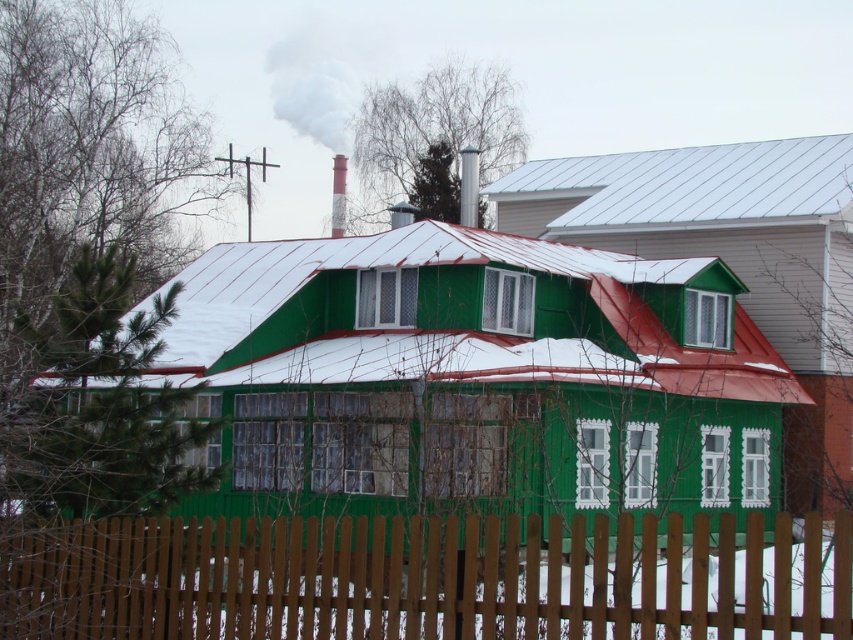
Is green painted wood at center further to camera compared to smooth metallic chimney at upper center?

No, it is in front of smooth metallic chimney at upper center.

This screenshot has height=640, width=853. I want to click on green painted wood at center, so click(x=457, y=264).

The width and height of the screenshot is (853, 640). Identify the location of green painted wood at center. (457, 264).

Between point (271, 268) and point (289, 33), which one is positioned behind?

The point (289, 33) is behind.

The height and width of the screenshot is (640, 853). What do you see at coordinates (457, 264) in the screenshot? I see `green painted wood at center` at bounding box center [457, 264].

Is point (270, 307) closer to viewer compared to point (310, 26)?

Yes.

Where is `green painted wood at center`? green painted wood at center is located at coordinates (457, 264).

Between brown wooden fence at lower center and white smoke at upper center, which one appears on the right side from the viewer's perspective?

Positioned to the right is brown wooden fence at lower center.

Who is more forward, [657,548] or [339,45]?

Positioned in front is point [657,548].

Locate an element on the screen. The image size is (853, 640). brown wooden fence at lower center is located at coordinates (412, 579).